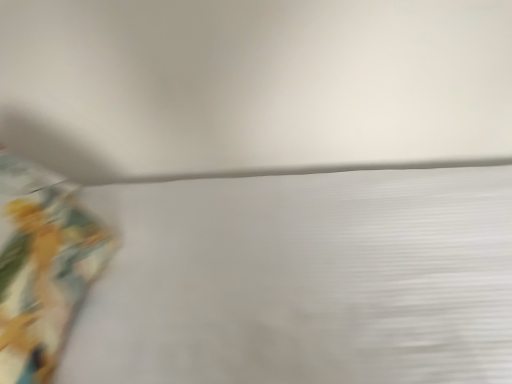
Question: Looking at their shapes, would you say matte yellow curtain at left is wider or thinner than white textured sheet at lower left?

Choices:
 (A) wide
 (B) thin

Answer: (B)

Question: Considering their positions, is matte yellow curtain at left located in front of or behind white textured sheet at lower left?

Choices:
 (A) front
 (B) behind

Answer: (B)

Question: Is matte yellow curtain at left inside the boundaries of white textured sheet at lower left, or outside?

Choices:
 (A) inside
 (B) outside

Answer: (A)

Question: Would you say white textured sheet at lower left is to the left or to the right of matte yellow curtain at left in the picture?

Choices:
 (A) right
 (B) left

Answer: (A)

Question: In terms of height, does white textured sheet at lower left look taller or shorter compared to matte yellow curtain at left?

Choices:
 (A) tall
 (B) short

Answer: (A)

Question: Considering the positions of white textured sheet at lower left and matte yellow curtain at left in the image, is white textured sheet at lower left wider or thinner than matte yellow curtain at left?

Choices:
 (A) wide
 (B) thin

Answer: (A)

Question: Is point (176, 296) closer or farther from the camera than point (58, 251)?

Choices:
 (A) farther
 (B) closer

Answer: (A)